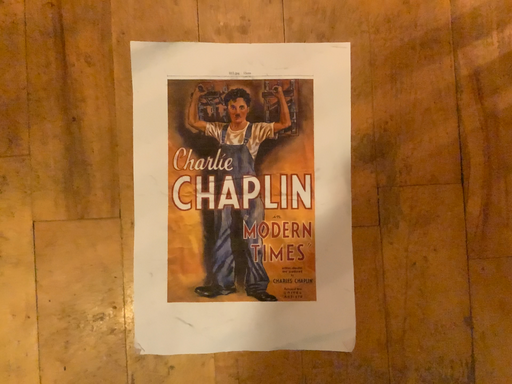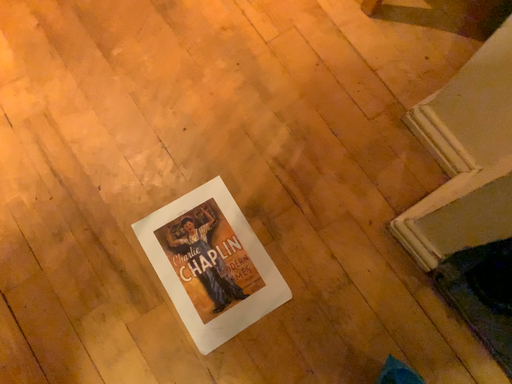
Question: How did the camera likely rotate when shooting the video?

Choices:
 (A) rotated downward
 (B) rotated upward

Answer: (B)